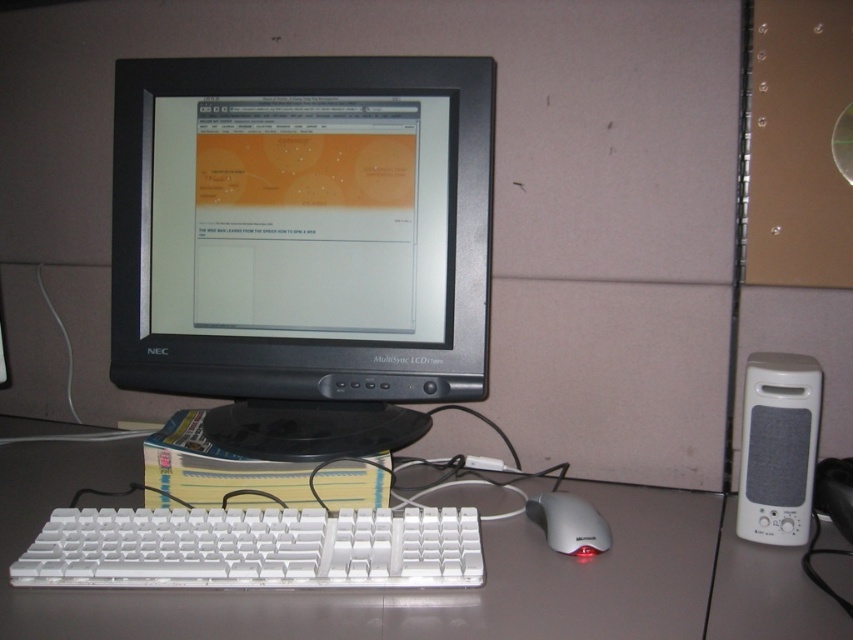
From the picture: You are setting up a desk for a video call. You have a black plastic monitor at center and a white plastic speaker at right. The recommended minimum distance between the monitor and speaker for optimal audio quality is 18 inches. Can you confirm if the current setup meets this requirement?

The distance between the black plastic monitor at center and the white plastic speaker at right is 18.10 inches, which exceeds the recommended minimum of 18 inches. Therefore, the setup meets the requirement for optimal audio quality.

You are setting up a new workspace and want to place your white plastic mouse at lower center and white plastic speaker at right on your desk. Based on the image, which object should be placed to the right side of the other?

The white plastic speaker at right should be placed to the right of the white plastic mouse at lower center.

You are a delivery person who just arrived at the workspace shown in the image. You need to place a small package exactly at the point labeled point (320, 408). Considering your arm length is 28 inches, can you reach that point without moving any furniture?

The point (320, 408) is 37.91 inches away from the camera, which is farther than your 28 inches arm length. Therefore, you cannot reach it without moving any furniture.